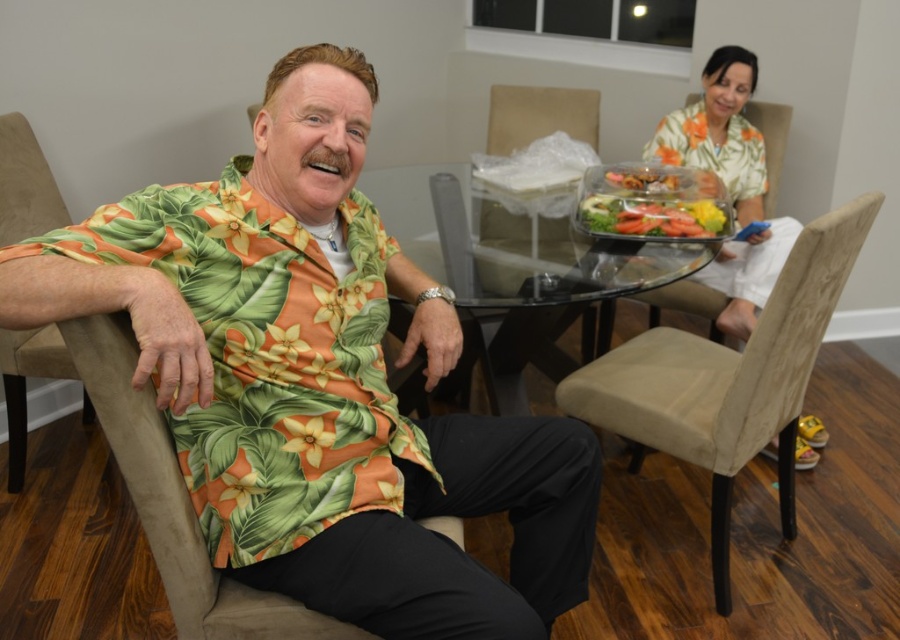
Can you confirm if beige fabric chair at lower right is smaller than translucent plastic container at center?

Actually, beige fabric chair at lower right might be larger than translucent plastic container at center.

Does beige fabric chair at lower right have a larger size compared to translucent plastic container at center?

Indeed, beige fabric chair at lower right has a larger size compared to translucent plastic container at center.

Describe the element at coordinates (727, 380) in the screenshot. This screenshot has width=900, height=640. I see `beige fabric chair at lower right` at that location.

I want to click on beige fabric chair at lower right, so click(727, 380).

Is translucent plastic container at center below beige fabric chair at center?

Yes.

This screenshot has width=900, height=640. What do you see at coordinates (652, 204) in the screenshot?
I see `translucent plastic container at center` at bounding box center [652, 204].

Who is more distant from viewer, (605, 168) or (554, 96)?

Point (554, 96)

Find the location of a particular element. translucent plastic container at center is located at coordinates (652, 204).

Which is in front, point (838, 256) or point (756, 230)?

Point (838, 256) is more forward.

Is point (677, 337) closer to camera compared to point (657, 125)?

That is True.

Identify the location of beige fabric chair at lower right. Image resolution: width=900 pixels, height=640 pixels. (727, 380).